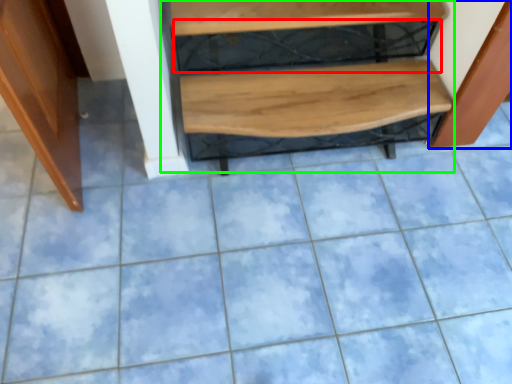
Question: Based on their relative distances, which object is farther from shelf (highlighted by a red box)? Choose from cabinetry (highlighted by a blue box) and stairwell (highlighted by a green box).

Choices:
 (A) cabinetry
 (B) stairwell

Answer: (A)